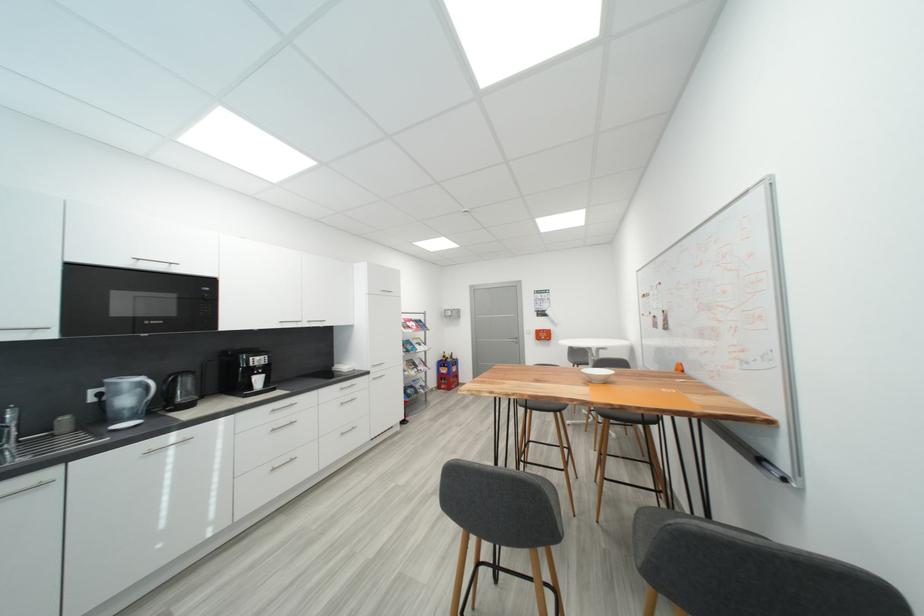
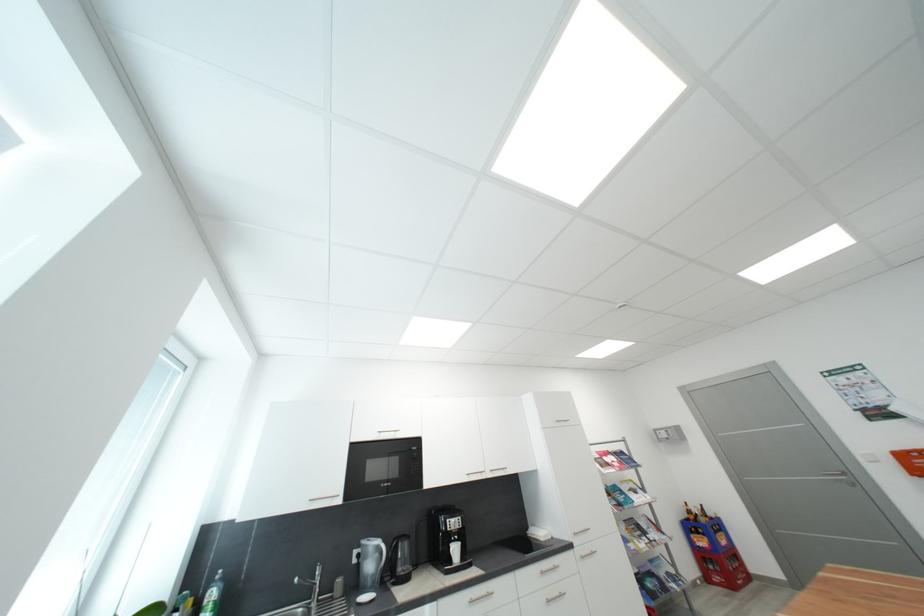
The images are taken continuously from a first-person perspective. In which direction is your viewpoint rotating?

The rotation direction of the camera is left-up.